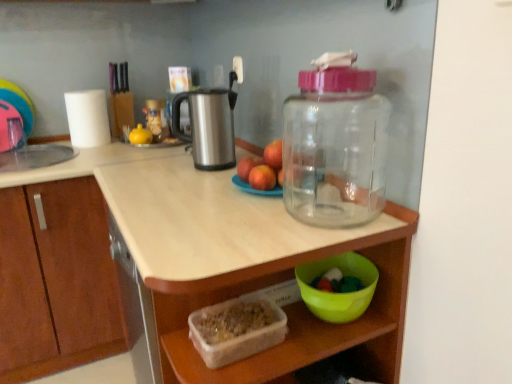
Measure the distance between red matte apple at center and camera.

red matte apple at center is 3.82 feet from camera.

The image size is (512, 384). What do you see at coordinates (87, 118) in the screenshot?
I see `white matte paper towel at upper left` at bounding box center [87, 118].

What do you see at coordinates (208, 127) in the screenshot? Image resolution: width=512 pixels, height=384 pixels. I see `brushed metal electric kettle at upper center` at bounding box center [208, 127].

What do you see at coordinates (184, 264) in the screenshot? The image size is (512, 384). I see `matte white countertop at center` at bounding box center [184, 264].

At what (x,y) coordinates should I click in order to perform the action: click on matte white countertop at center. Please return your answer as a coordinate pair (x, y). Looking at the image, I should click on (184, 264).

Find the location of `green plastic bowl at lower right, which is the 1th bowl in right-to-left order`. green plastic bowl at lower right, which is the 1th bowl in right-to-left order is located at coordinates (339, 293).

The width and height of the screenshot is (512, 384). I want to click on translucent plastic container at lower center, so click(x=295, y=329).

Can we say yellow rubber duck at center lies outside red matte apple at center?

Yes, yellow rubber duck at center is outside of red matte apple at center.

Considering the relative positions of yellow rubber duck at center and red matte apple at center in the image provided, is yellow rubber duck at center in front of red matte apple at center?

That is False.

Is point (145, 134) in front of point (268, 175)?

No, it is not.

How different are the orientations of yellow rubber duck at center and red matte apple at center in degrees?

They differ by 60.4 degrees in their facing directions.

Locate an element on the screen. The width and height of the screenshot is (512, 384). apple above the translucent plastic container at lower center, which appears as the second bowl when viewed from the right (from a real-world perspective) is located at coordinates (262, 178).

Does translucent plastic container at lower center, which appears as the second bowl when viewed from the right, lie behind red matte apple at center?

That is False.

Is translucent plastic container at lower center, which is counted as the 1th bowl, starting from the left, not inside red matte apple at center?

Absolutely, translucent plastic container at lower center, which is counted as the 1th bowl, starting from the left, is external to red matte apple at center.

Who is shorter, translucent plastic container at lower center, which appears as the second bowl when viewed from the right, or red matte apple at center?

red matte apple at center.

How much distance is there between yellow rubber duck at center and green plastic bowl at lower right, which is the 1th bowl in right-to-left order?

yellow rubber duck at center is 3.50 feet from green plastic bowl at lower right, which is the 1th bowl in right-to-left order.

Can you confirm if yellow rubber duck at center is wider than green plastic bowl at lower right, positioned as the 2th bowl in left-to-right order?

In fact, yellow rubber duck at center might be narrower than green plastic bowl at lower right, positioned as the 2th bowl in left-to-right order.

Which is behind, point (131, 142) or point (367, 303)?

Positioned behind is point (131, 142).

Where is `toy located on the left of green plastic bowl at lower right, positioned as the 2th bowl in left-to-right order`? Image resolution: width=512 pixels, height=384 pixels. toy located on the left of green plastic bowl at lower right, positioned as the 2th bowl in left-to-right order is located at coordinates (140, 135).

Does translucent plastic container at lower center have a lesser height compared to green plastic bowl at lower right, positioned as the 2th bowl in left-to-right order?

Incorrect, the height of translucent plastic container at lower center does not fall short of that of green plastic bowl at lower right, positioned as the 2th bowl in left-to-right order.

From the picture: How many degrees apart are the facing directions of translucent plastic container at lower center and green plastic bowl at lower right, which is the 1th bowl in right-to-left order?

They differ by 89.7 degrees in their facing directions.

Which is in front, point (200, 296) or point (317, 270)?

Positioned in front is point (200, 296).

From a real-world perspective, is translucent plastic container at lower center under green plastic bowl at lower right, positioned as the 2th bowl in left-to-right order?

Yes.

What's the angular difference between transparent plastic bottle at upper right and translucent plastic container at lower center's facing directions?

There is a 0.564-degree angle between the facing directions of transparent plastic bottle at upper right and translucent plastic container at lower center.

Would you say transparent plastic bottle at upper right is a long distance from translucent plastic container at lower center?

No, transparent plastic bottle at upper right is in close proximity to translucent plastic container at lower center.

Consider the image. Who is taller, transparent plastic bottle at upper right or translucent plastic container at lower center?

translucent plastic container at lower center.

Between transparent plastic bottle at upper right and translucent plastic container at lower center, which one is positioned in front?

translucent plastic container at lower center is in front.

From a real-world perspective, which object stands above the other?

brushed metal electric kettle at upper center, from a real-world perspective.

From the image's perspective, is brushed metal electric kettle at upper center on top of yellow rubber duck at center?

Incorrect, from the image's perspective, brushed metal electric kettle at upper center is lower than yellow rubber duck at center.

Is brushed metal electric kettle at upper center placed right next to yellow rubber duck at center?

brushed metal electric kettle at upper center and yellow rubber duck at center are clearly separated.

Can you confirm if brushed metal electric kettle at upper center is wider than yellow rubber duck at center?

Correct, the width of brushed metal electric kettle at upper center exceeds that of yellow rubber duck at center.

Consider the image. Is red matte apple at center positioned far away from translucent plastic container at lower center, which appears as the second bowl when viewed from the right?

No.

Consider the image. From the image's perspective, between red matte apple at center and translucent plastic container at lower center, which is counted as the 1th bowl, starting from the left, who is located below?

From the image's view, translucent plastic container at lower center, which is counted as the 1th bowl, starting from the left, is below.

How many degrees apart are the facing directions of red matte apple at center and translucent plastic container at lower center, which appears as the second bowl when viewed from the right?

red matte apple at center and translucent plastic container at lower center, which appears as the second bowl when viewed from the right, are facing 90.1 degrees away from each other.

At what (x,y) coordinates should I click in order to perform the action: click on apple located in front of the yellow rubber duck at center. Please return your answer as a coordinate pair (x, y). Looking at the image, I should click on (262, 178).

The height and width of the screenshot is (384, 512). I want to click on apple on the right of the translucent plastic container at lower center, which appears as the second bowl when viewed from the right, so click(x=262, y=178).

When comparing their distances from translucent plastic container at lower center, which appears as the second bowl when viewed from the right, does brushed metal electric kettle at upper center or matte white countertop at center seem further?

Result: brushed metal electric kettle at upper center is further to translucent plastic container at lower center, which appears as the second bowl when viewed from the right.

Which object lies nearer to the anchor point green plastic bowl at lower right, which is the 1th bowl in right-to-left order, brushed metal electric kettle at upper center or transparent plastic bottle at upper right?

transparent plastic bottle at upper right is closer to green plastic bowl at lower right, which is the 1th bowl in right-to-left order.

Consider the image. When comparing their distances from brushed metal electric kettle at upper center, does matte white countertop at center or white matte paper towel at upper left seem closer?

The object closer to brushed metal electric kettle at upper center is matte white countertop at center.

Which object lies nearer to the anchor point matte white countertop at center, transparent plastic bottle at upper right or red matte apple at center?

transparent plastic bottle at upper right.

Which object lies further to the anchor point red matte apple at center, matte white countertop at center or translucent plastic container at lower center?

The object further to red matte apple at center is matte white countertop at center.

When comparing their distances from green plastic bowl at lower right, positioned as the 2th bowl in left-to-right order, does red matte apple at center or matte white countertop at center seem closer?

red matte apple at center lies closer to green plastic bowl at lower right, positioned as the 2th bowl in left-to-right order, than the other object.

Consider the image. Considering their positions, is yellow rubber duck at center positioned further to translucent plastic container at lower center than transparent plastic bottle at upper right?

yellow rubber duck at center is further to translucent plastic container at lower center.

Which object lies further to the anchor point matte white countertop at center, transparent plastic bottle at upper right or translucent plastic container at lower center, which is counted as the 1th bowl, starting from the left?

translucent plastic container at lower center, which is counted as the 1th bowl, starting from the left, lies further to matte white countertop at center than the other object.

The width and height of the screenshot is (512, 384). Find the location of `apple situated between matte white countertop at center and transparent plastic bottle at upper right from left to right`. apple situated between matte white countertop at center and transparent plastic bottle at upper right from left to right is located at coordinates (262, 178).

At what (x,y) coordinates should I click in order to perform the action: click on apple positioned between green plastic bowl at lower right, which is the 1th bowl in right-to-left order, and yellow rubber duck at center from near to far. Please return your answer as a coordinate pair (x, y). Looking at the image, I should click on (262, 178).

Locate an element on the screen. countertop between white matte paper towel at upper left and red matte apple at center in the horizontal direction is located at coordinates (184, 264).

Locate an element on the screen. Image resolution: width=512 pixels, height=384 pixels. countertop between translucent plastic container at lower center and yellow rubber duck at center from front to back is located at coordinates (184, 264).